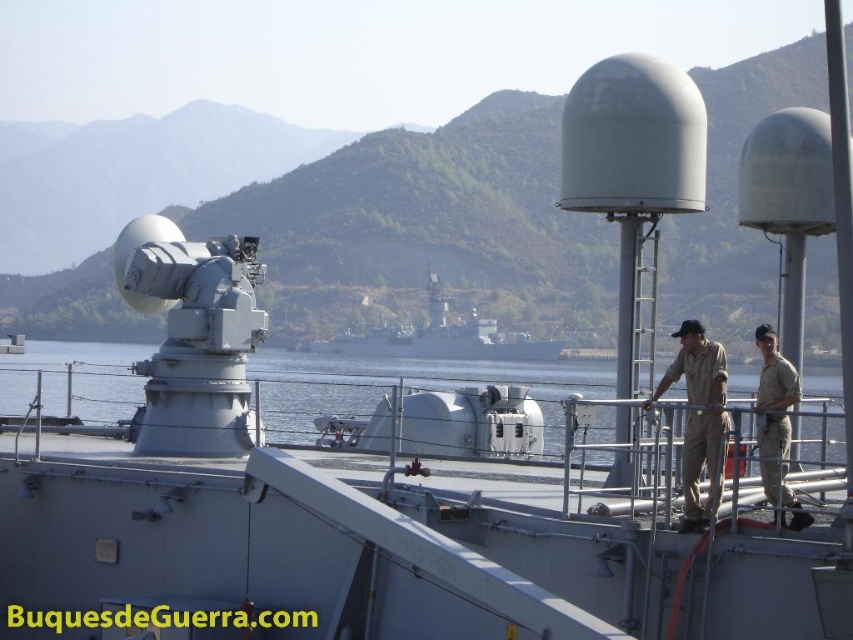
You are a crew member on the naval ship. You need to move from point A to point B. Point A is at coordinates point (465, 340) and point B is at coordinates point (766, 406). Which point is closer to the radar unit on the left side of the deck?

Point (766, 406) is closer to the radar unit on the left side of the deck because it is in front of point (465, 340), which is behind it.